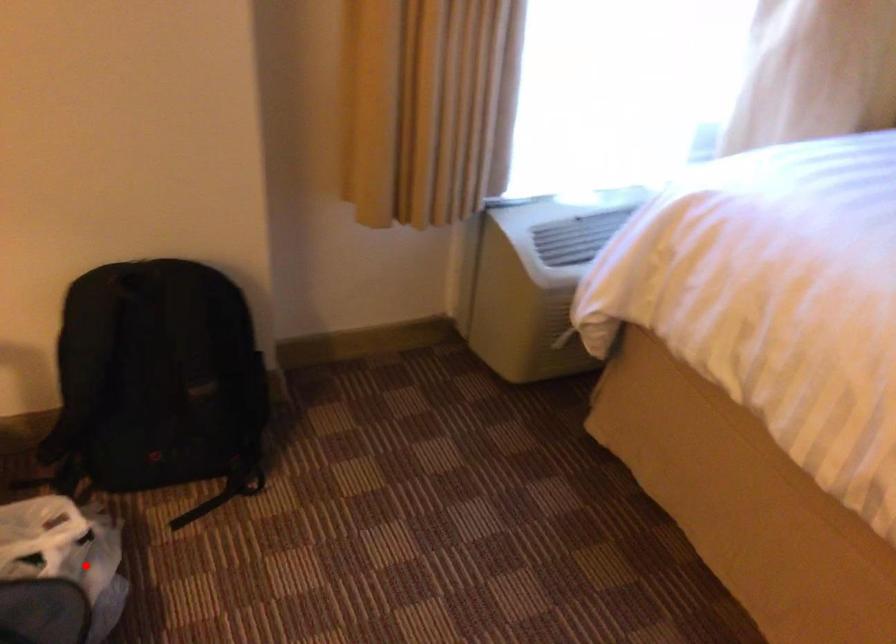
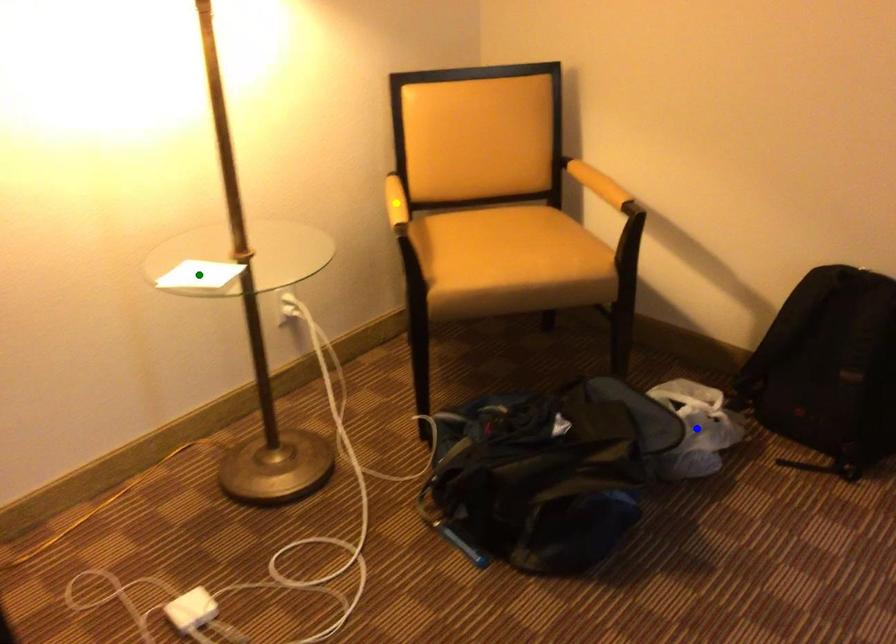
Question: I am providing you with two images of the same scene from different viewpoints. A red point is marked on the first image. You are given multiple points on the second image. In image 2, which mark is for the same physical point as the one in image 1?

Choices:
 (A) blue point
 (B) green point
 (C) yellow point

Answer: (A)